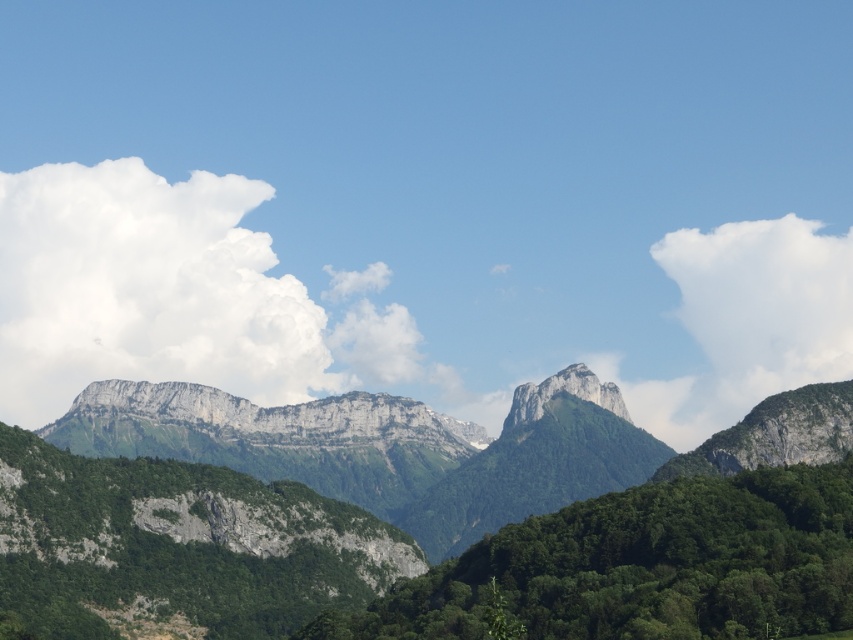
Does point (665, 620) come behind point (529, 556)?

No, it is in front of (529, 556).

Which is in front, point (616, 561) or point (782, 579)?

Positioned in front is point (782, 579).

You are a GUI agent. You are given a task and a screenshot of the screen. Output one action in this format:
    pyautogui.click(x=<x>, y=<y>)
    Task: Click on the green rocky mountain at center
    The width and height of the screenshot is (853, 640).
    Given the screenshot: What is the action you would take?
    pyautogui.click(x=438, y=528)

Who is taller, green rocky mountain at center or white fluffy cloud at upper left?

Standing taller between the two is white fluffy cloud at upper left.

Can you confirm if green rocky mountain at center is shorter than white fluffy cloud at upper left?

Indeed, green rocky mountain at center has a lesser height compared to white fluffy cloud at upper left.

Measure the distance between green rocky mountain at center and camera.

green rocky mountain at center and camera are 229.65 meters apart from each other.

Identify the location of green rocky mountain at center. (438, 528).

Measure the distance from white fluffy cloud at upper left to white fluffy cloud at upper right.

The distance of white fluffy cloud at upper left from white fluffy cloud at upper right is 501.51 feet.

You are a GUI agent. You are given a task and a screenshot of the screen. Output one action in this format:
    pyautogui.click(x=<x>, y=<y>)
    Task: Click on the white fluffy cloud at upper left
    The image size is (853, 640).
    Given the screenshot: What is the action you would take?
    pyautogui.click(x=146, y=289)

Is point (227, 316) less distant than point (839, 264)?

Yes, it is.

Where is `white fluffy cloud at upper left`? The image size is (853, 640). white fluffy cloud at upper left is located at coordinates (146, 289).